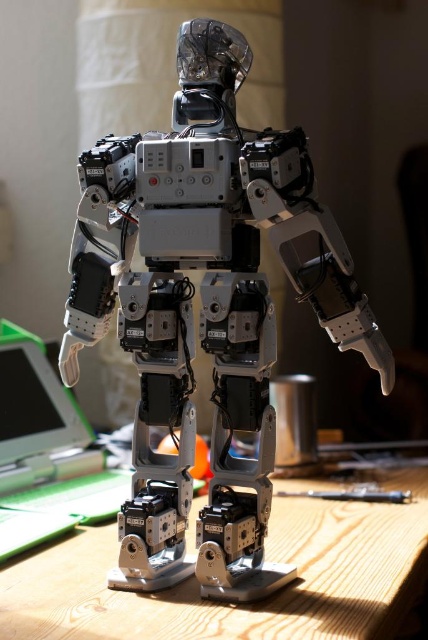
Question: Considering the relative positions of metallic silver robot at center and wooden table at lower center in the image provided, where is metallic silver robot at center located with respect to wooden table at lower center?

Choices:
 (A) left
 (B) right

Answer: (A)

Question: Which of the following is the closest to the observer?

Choices:
 (A) (368, 604)
 (B) (246, 141)

Answer: (A)

Question: Does metallic silver robot at center have a lesser width compared to wooden table at lower center?

Choices:
 (A) yes
 (B) no

Answer: (A)

Question: Is metallic silver robot at center to the right of wooden table at lower center from the viewer's perspective?

Choices:
 (A) no
 (B) yes

Answer: (A)

Question: Among these points, which one is nearest to the camera?

Choices:
 (A) (253, 292)
 (B) (85, 604)

Answer: (B)